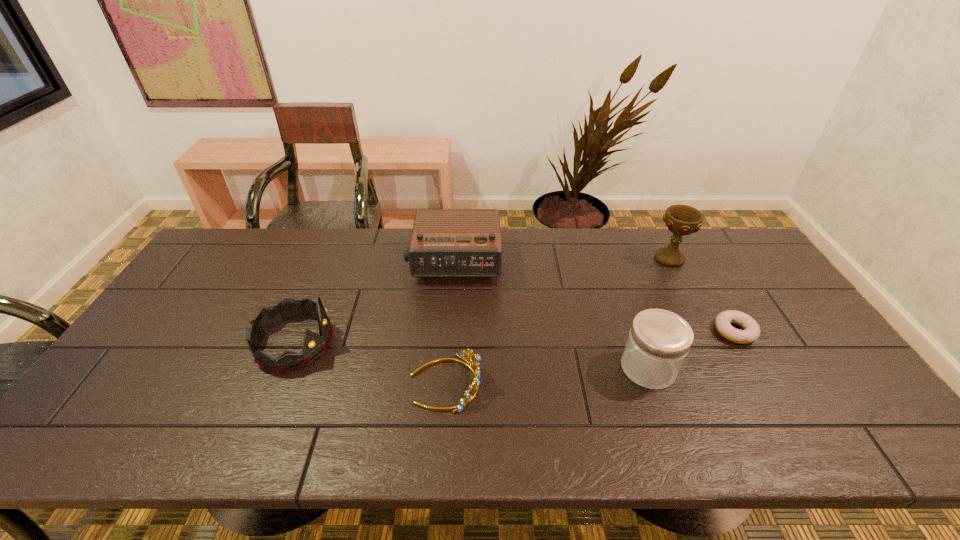
At what (x,y) coordinates should I click in order to perform the action: click on chalice. Please return your answer as a coordinate pair (x, y). This screenshot has height=540, width=960. Looking at the image, I should click on (681, 220).

You are a GUI agent. You are given a task and a screenshot of the screen. Output one action in this format:
    pyautogui.click(x=<x>, y=<y>)
    Task: Click on the radio receiver
    
    Given the screenshot: What is the action you would take?
    click(x=444, y=242)

Where is `the taller tiara`? the taller tiara is located at coordinates (314, 346).

Find the location of `the left tiara`. the left tiara is located at coordinates (314, 346).

The image size is (960, 540). I want to click on jar, so click(658, 342).

Find the location of a particular element. the shorter tiara is located at coordinates (474, 364).

Locate an element on the screen. The width and height of the screenshot is (960, 540). the right tiara is located at coordinates (474, 364).

Identify the location of doughnut. (751, 332).

The height and width of the screenshot is (540, 960). In order to click on vacant position located 0.270m on the front of the chalice in this screenshot , I will do `click(708, 332)`.

Locate an element on the screen. The image size is (960, 540). blank space located 0.070m on the front panel of the radio receiver is located at coordinates (452, 300).